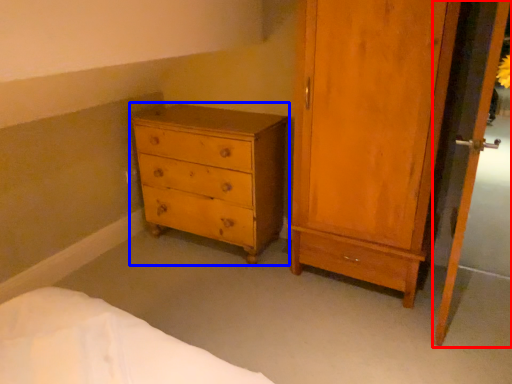
Question: Which object is further to the camera taking this photo, screen door (highlighted by a red box) or chest of drawers (highlighted by a blue box)?

Choices:
 (A) screen door
 (B) chest of drawers

Answer: (B)